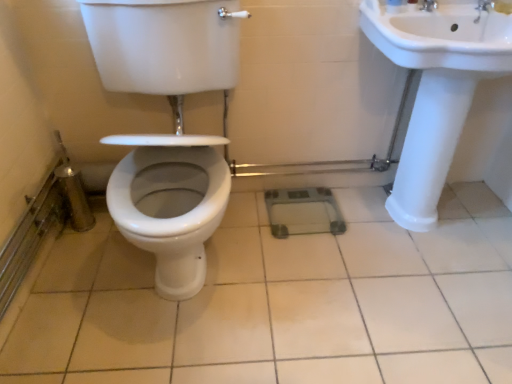
In order to face silver metallic faucet at upper right, should I rotate leftwards or rightwards?

To align with it, rotate right about 22.877°.

This screenshot has height=384, width=512. What are the coordinates of `silver metallic faucet at upper right` in the screenshot? It's located at (429, 5).

Find the location of a particular element. This screenshot has height=384, width=512. white glossy sink at right is located at coordinates (436, 92).

Is there a large distance between silver metallic faucet at upper right and white glossy tile at center?

silver metallic faucet at upper right is positioned a significant distance from white glossy tile at center.

Considering the relative sizes of silver metallic faucet at upper right and white glossy tile at center in the image provided, is silver metallic faucet at upper right smaller than white glossy tile at center?

A: Indeed, silver metallic faucet at upper right has a smaller size compared to white glossy tile at center.

Is white glossy tile at center surrounded by silver metallic faucet at upper right?

That's incorrect, white glossy tile at center is not inside silver metallic faucet at upper right.

Could you tell me if silver metallic faucet at upper right is turned towards white glossy tile at center?

No, silver metallic faucet at upper right is not turned towards white glossy tile at center.

Does white glossy toilet at center have a lesser height compared to silver metallic faucet at upper right?

No, white glossy toilet at center is not shorter than silver metallic faucet at upper right.

This screenshot has width=512, height=384. I want to click on toilet below the silver metallic faucet at upper right (from the image's perspective), so click(x=174, y=123).

From the image's perspective, is white glossy toilet at center located beneath silver metallic faucet at upper right?

Indeed, from the image's perspective, white glossy toilet at center is shown beneath silver metallic faucet at upper right.

Considering the points (485, 44) and (432, 320), which point is in front, point (485, 44) or point (432, 320)?

Point (485, 44)

Is white glossy sink at right thinner than white glossy tile at center?

Yes, white glossy sink at right is thinner than white glossy tile at center.

Are white glossy sink at right and white glossy tile at center beside each other?

No, white glossy sink at right is not with white glossy tile at center.

Between white glossy sink at right and white glossy tile at center, which one is positioned behind?

white glossy tile at center is more distant.

How far apart are silver metallic faucet at upper right and white glossy sink at right?

41.16 centimeters.

From a real-world perspective, is silver metallic faucet at upper right physically below white glossy sink at right?

No, from a real-world perspective, silver metallic faucet at upper right is not under white glossy sink at right.

Is silver metallic faucet at upper right with white glossy sink at right?

No, silver metallic faucet at upper right is not in contact with white glossy sink at right.

Would you say silver metallic faucet at upper right is outside white glossy sink at right?

That's incorrect, silver metallic faucet at upper right is not completely outside white glossy sink at right.

Is white glossy toilet at center facing towards white glossy tile at center?

No.

Which of these two, white glossy toilet at center or white glossy tile at center, stands shorter?

Standing shorter between the two is white glossy tile at center.

Is the surface of white glossy toilet at center in direct contact with white glossy tile at center?

white glossy toilet at center and white glossy tile at center are clearly separated.

Looking at this image, from a real-world perspective, which is physically above, white glossy tile at center or white glossy toilet at center?

white glossy toilet at center, from a real-world perspective.

Is white glossy tile at center positioned far away from white glossy toilet at center?

Actually, white glossy tile at center and white glossy toilet at center are a little close together.

Locate an element on the screen. toilet above the white glossy tile at center (from a real-world perspective) is located at coordinates (174, 123).

Is white glossy tile at center oriented towards white glossy toilet at center?

No, white glossy tile at center is not oriented towards white glossy toilet at center.

Considering the relative positions of white glossy sink at right and silver metallic faucet at upper right in the image provided, is white glossy sink at right in front of silver metallic faucet at upper right?

Yes, the depth of white glossy sink at right is less than that of silver metallic faucet at upper right.

Which object is positioned more to the left, white glossy sink at right or silver metallic faucet at upper right?

silver metallic faucet at upper right is more to the left.

Considering the positions of points (400, 13) and (423, 3), is point (400, 13) farther from camera compared to point (423, 3)?

No.

Is white glossy sink at right taller or shorter than silver metallic faucet at upper right?

In the image, white glossy sink at right appears to be taller than silver metallic faucet at upper right.

At what (x,y) coordinates should I click in order to perform the action: click on ceramic tile below the silver metallic faucet at upper right (from the image's perspective). Please return your answer as a coordinate pair (x, y). Looking at the image, I should click on (282, 303).

The height and width of the screenshot is (384, 512). Identify the location of toilet on the left of the silver metallic faucet at upper right. (174, 123).

When comparing their distances from silver metallic faucet at upper right, does white glossy tile at center or white glossy toilet at center seem closer?

white glossy toilet at center is positioned closer to the anchor silver metallic faucet at upper right.

Which object lies further to the anchor point white glossy toilet at center, white glossy sink at right or silver metallic faucet at upper right?

Based on the image, silver metallic faucet at upper right appears to be further to white glossy toilet at center.

Estimate the real-world distances between objects in this image. Which object is closer to white glossy sink at right, white glossy tile at center or white glossy toilet at center?

white glossy tile at center is positioned closer to the anchor white glossy sink at right.

When comparing their distances from white glossy toilet at center, does silver metallic faucet at upper right or white glossy tile at center seem closer?

white glossy tile at center is positioned closer to the anchor white glossy toilet at center.

Looking at the image, which one is located further to silver metallic faucet at upper right, white glossy toilet at center or white glossy tile at center?

white glossy tile at center is positioned further to the anchor silver metallic faucet at upper right.

Looking at the image, which one is located closer to white glossy tile at center, silver metallic faucet at upper right or white glossy sink at right?

The object closer to white glossy tile at center is white glossy sink at right.

When comparing their distances from silver metallic faucet at upper right, does white glossy tile at center or white glossy sink at right seem further?

Based on the image, white glossy tile at center appears to be further to silver metallic faucet at upper right.

Looking at the image, which one is located closer to white glossy sink at right, silver metallic faucet at upper right or white glossy tile at center?

silver metallic faucet at upper right is positioned closer to the anchor white glossy sink at right.

Where is `sink between silver metallic faucet at upper right and white glossy tile at center in the vertical direction`? The width and height of the screenshot is (512, 384). sink between silver metallic faucet at upper right and white glossy tile at center in the vertical direction is located at coordinates (436, 92).

Locate an element on the screen. The image size is (512, 384). toilet that lies between silver metallic faucet at upper right and white glossy tile at center from top to bottom is located at coordinates (174, 123).

Locate an element on the screen. tap located between white glossy toilet at center and white glossy sink at right in the left-right direction is located at coordinates (429, 5).

Find the location of a particular element. ceramic tile between white glossy toilet at center and white glossy sink at right from left to right is located at coordinates pos(282,303).